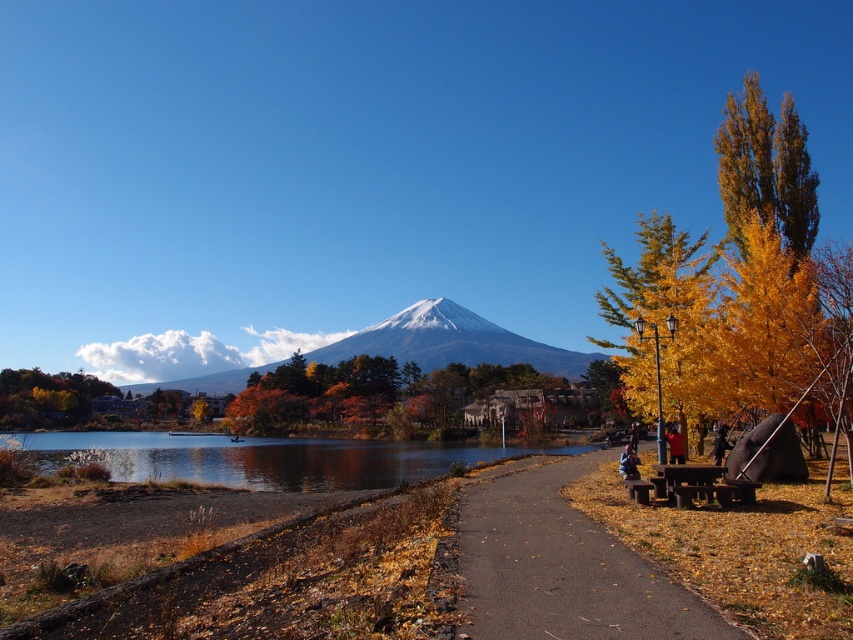
Question: Does golden leafy tree at lower left lie behind yellow fabric jacket at right?

Choices:
 (A) yes
 (B) no

Answer: (A)

Question: From the image, what is the correct spatial relationship of brown asphalt path at center in relation to golden leafy tree at lower left?

Choices:
 (A) left
 (B) right

Answer: (B)

Question: Which point is closer to the camera?

Choices:
 (A) (543, 365)
 (B) (811, 276)
 (C) (170, 435)

Answer: (B)

Question: Which object is positioned farthest from the golden leafy tree at lower left?

Choices:
 (A) clear water at lower left
 (B) white snow-covered mountain at center

Answer: (B)

Question: Which of the following is the farthest from the observer?

Choices:
 (A) (689, 609)
 (B) (782, 310)
 (C) (601, 356)
 (D) (102, 388)

Answer: (C)

Question: Does golden leafy tree at right appear over clear water at lower left?

Choices:
 (A) yes
 (B) no

Answer: (A)